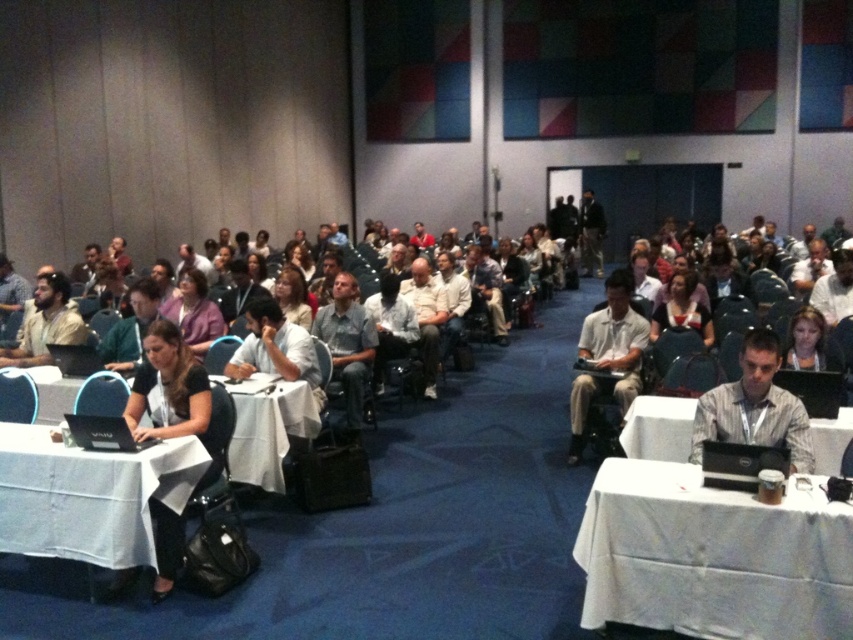
Question: Which is nearer to the matte purple shirt at center?

Choices:
 (A) matte white shirt at center
 (B) white fabric laptop at center
 (C) white cloth-covered table at lower right

Answer: (A)

Question: Estimate the real-world distances between objects in this image. Which object is closer to the black matte laptop at lower left?

Choices:
 (A) white cloth table at center
 (B) matte purple shirt at center

Answer: (A)

Question: Which of the following is the closest to the observer?

Choices:
 (A) light gray shirt at center
 (B) white cloth-covered table at lower left

Answer: (B)

Question: Can you confirm if white cloth-covered table at lower right is positioned above black matte laptop at lower left?

Choices:
 (A) yes
 (B) no

Answer: (B)

Question: Can you confirm if black fabric laptop at lower left is positioned to the right of white plastic table at lower right?

Choices:
 (A) yes
 (B) no

Answer: (B)

Question: Is white cloth-covered table at lower right below light gray striped shirt at center?

Choices:
 (A) no
 (B) yes

Answer: (B)